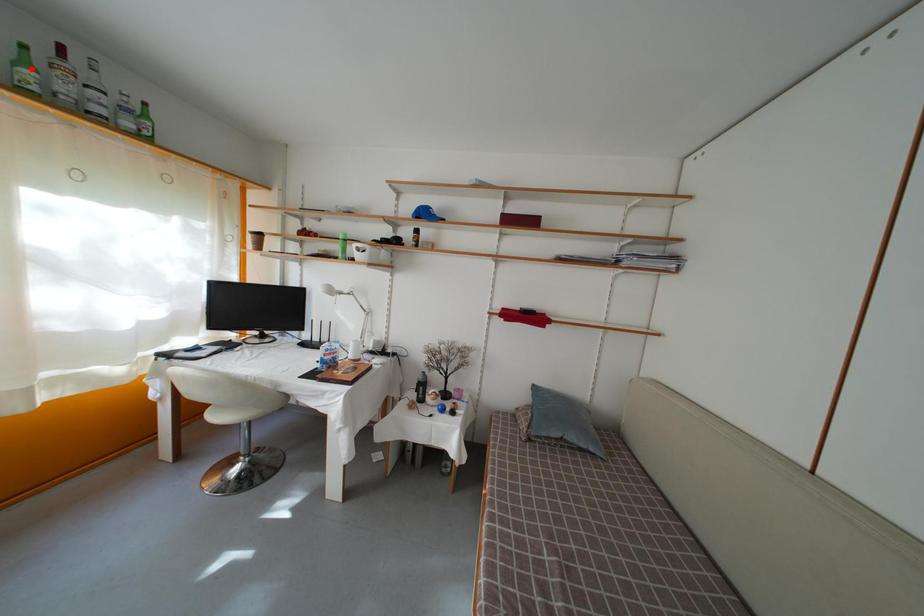
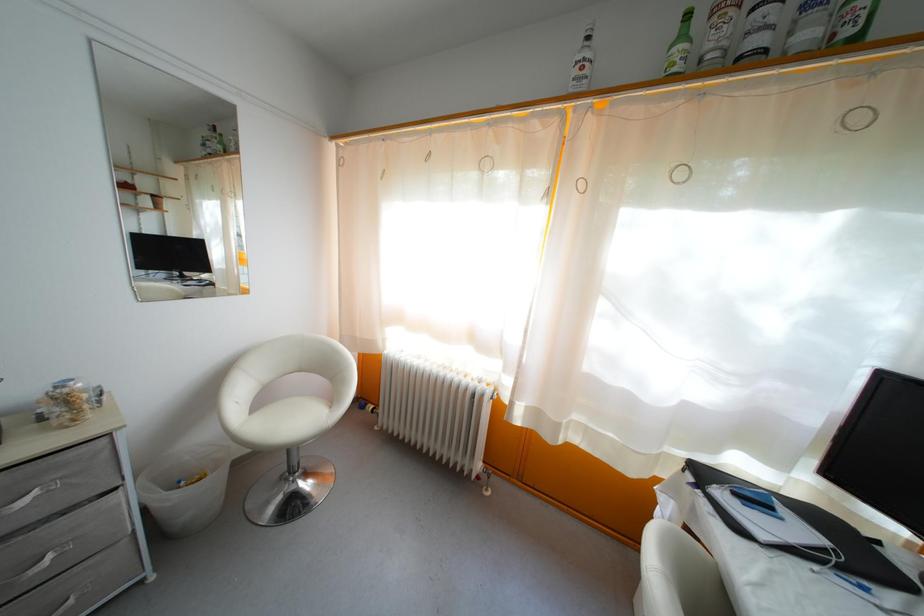
The point at the highlighted location is marked in the first image. Where is the corresponding point in the second image?

(688, 43)